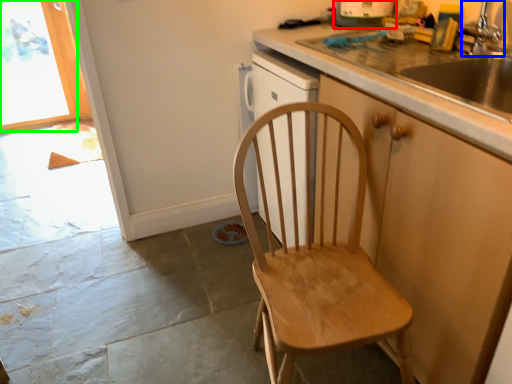
Question: Estimate the real-world distances between objects in this image. Which object is closer to kitchen appliance (highlighted by a red box), faucet (highlighted by a blue box) or window (highlighted by a green box)?

Choices:
 (A) faucet
 (B) window

Answer: (A)